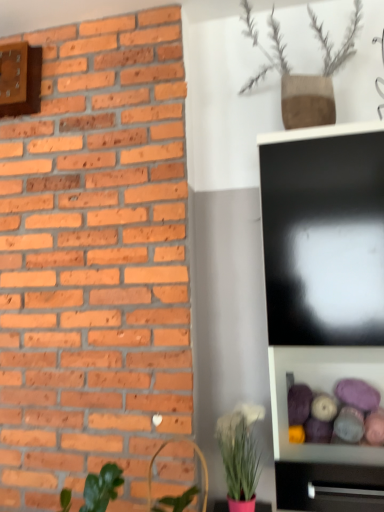
Question: From a real-world perspective, is brown textured vase at upper center, which is the 2th houseplant from bottom to top, under matte pink pot at lower center, marked as the 2th houseplant in a top-to-bottom arrangement?

Choices:
 (A) no
 (B) yes

Answer: (A)

Question: Considering the relative sizes of brown textured vase at upper center, which is counted as the 1th houseplant, starting from the top, and matte pink pot at lower center, marked as the 2th houseplant in a top-to-bottom arrangement, in the image provided, is brown textured vase at upper center, which is counted as the 1th houseplant, starting from the top, taller than matte pink pot at lower center, marked as the 2th houseplant in a top-to-bottom arrangement,?

Choices:
 (A) no
 (B) yes

Answer: (B)

Question: Does brown textured vase at upper center, which is counted as the 1th houseplant, starting from the top, have a larger size compared to matte pink pot at lower center, marked as the 2th houseplant in a top-to-bottom arrangement?

Choices:
 (A) yes
 (B) no

Answer: (A)

Question: Does brown textured vase at upper center, which is counted as the 1th houseplant, starting from the top, appear on the left side of matte pink pot at lower center, which ranks as the first houseplant in bottom-to-top order?

Choices:
 (A) yes
 (B) no

Answer: (B)

Question: Does brown textured vase at upper center, which is the 2th houseplant from bottom to top, have a smaller size compared to matte pink pot at lower center, which ranks as the first houseplant in bottom-to-top order?

Choices:
 (A) no
 (B) yes

Answer: (A)

Question: Does brown textured vase at upper center, which is the 2th houseplant from bottom to top, have a lesser width compared to matte pink pot at lower center, marked as the 2th houseplant in a top-to-bottom arrangement?

Choices:
 (A) yes
 (B) no

Answer: (A)

Question: Is brown textured vase at upper center, which is the 2th houseplant from bottom to top, inside black glossy tv cabinet at lower right?

Choices:
 (A) no
 (B) yes

Answer: (A)

Question: Is black glossy tv cabinet at lower right thinner than brown textured vase at upper center, which is counted as the 1th houseplant, starting from the top?

Choices:
 (A) yes
 (B) no

Answer: (A)

Question: Does black glossy tv cabinet at lower right appear on the left side of brown textured vase at upper center, which is counted as the 1th houseplant, starting from the top?

Choices:
 (A) yes
 (B) no

Answer: (B)

Question: From the image's perspective, is black glossy tv cabinet at lower right located beneath brown textured vase at upper center, which is counted as the 1th houseplant, starting from the top?

Choices:
 (A) no
 (B) yes

Answer: (B)

Question: Is black glossy tv cabinet at lower right located outside brown textured vase at upper center, which is counted as the 1th houseplant, starting from the top?

Choices:
 (A) no
 (B) yes

Answer: (B)

Question: Does black glossy tv cabinet at lower right have a smaller size compared to brown textured vase at upper center, which is counted as the 1th houseplant, starting from the top?

Choices:
 (A) yes
 (B) no

Answer: (A)

Question: From the image's perspective, is wooden clock at upper left on black glossy tv cabinet at lower right?

Choices:
 (A) yes
 (B) no

Answer: (A)